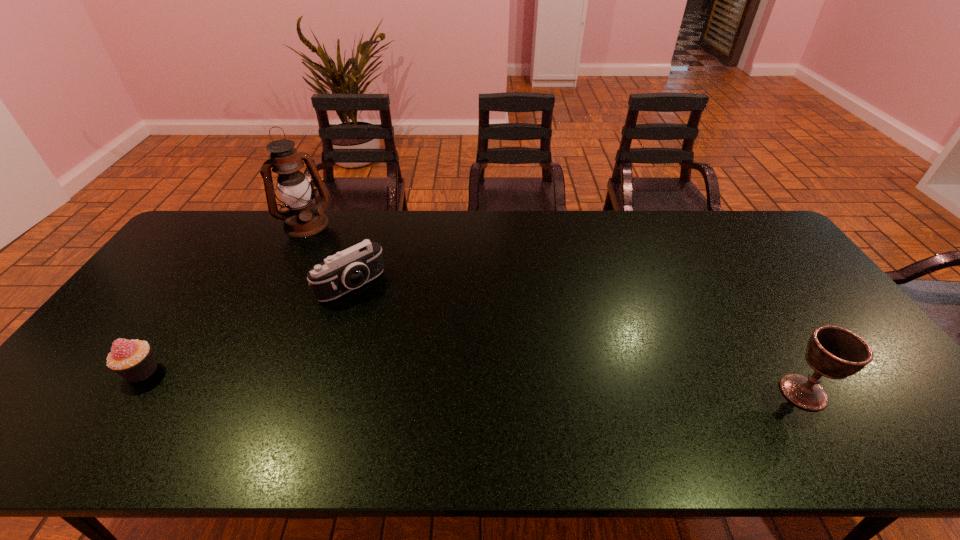
At what (x,y) coordinates should I click in order to perform the action: click on free spot on the desktop that is between the cupcake and the chalice and is positioned on the front lens of the camera. Please return your answer as a coordinate pair (x, y). The height and width of the screenshot is (540, 960). Looking at the image, I should click on (447, 381).

Where is `free spot on the desktop that is between the leftmost object and the chalice and is positioned on the side of the third object from right to left, there is a wick adjustment knob`? The width and height of the screenshot is (960, 540). free spot on the desktop that is between the leftmost object and the chalice and is positioned on the side of the third object from right to left, there is a wick adjustment knob is located at coordinates pos(384,379).